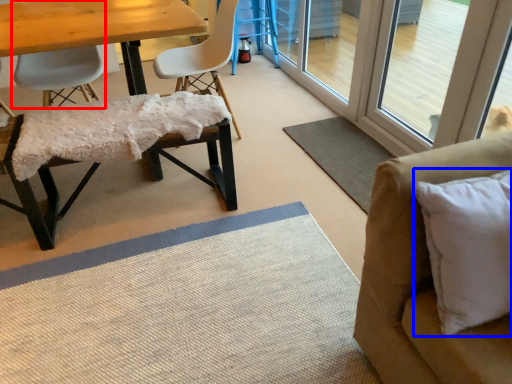
Question: Which object is closer to the camera taking this photo, chair (highlighted by a red box) or pillow (highlighted by a blue box)?

Choices:
 (A) chair
 (B) pillow

Answer: (B)